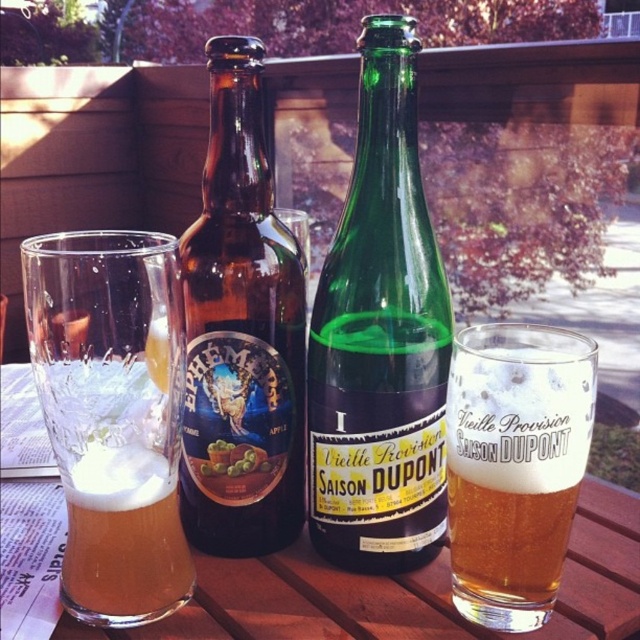
Is brown glass bottle at center wider than brown wooden picnic table at center?

No.

Who is positioned more to the left, brown glass bottle at center or brown wooden picnic table at center?

From the viewer's perspective, brown wooden picnic table at center appears more on the left side.

Who is more distant from viewer, (227, 522) or (230, 600)?

The point (227, 522) is behind.

Where is `brown glass bottle at center`? brown glass bottle at center is located at coordinates (241, 332).

Does clear glass mug at left have a lesser width compared to brown wooden picnic table at center?

Yes, clear glass mug at left is thinner than brown wooden picnic table at center.

Does clear glass mug at left lie behind brown wooden picnic table at center?

No, it is not.

Is point (166, 316) positioned after point (316, 604)?

No, (166, 316) is closer to viewer.

The width and height of the screenshot is (640, 640). What are the coordinates of `clear glass mug at left` in the screenshot? It's located at (113, 416).

Between point (168, 358) and point (211, 160), which one is positioned in front?

Point (168, 358) is more forward.

Identify the location of clear glass mug at left. This screenshot has height=640, width=640. (113, 416).